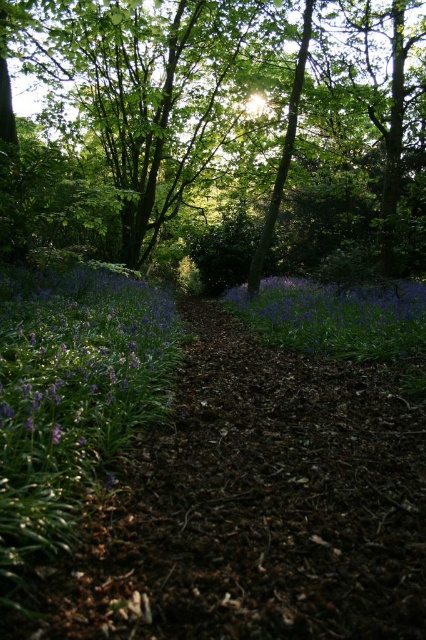
You are standing at the center of the woodland path and see the green leafy tree at center. If you walk straight ahead, will you eventually reach the tree?

The green leafy tree at center is located at point (219,125), which is in front of your current position at the center of the path. Therefore, walking straight ahead will lead you directly to the tree.

You are a gardener who wants to plant a new flower between the green leafy tree at center and the purple matte flower at center. The new flower requires a minimum of 4 meters of space between it and any existing plants. Can you plant it in this location?

The distance between the green leafy tree at center and the purple matte flower at center is 5.21 meters. Since the new flower requires at least 4 meters of space between it and existing plants, planting it between them would require the total distance to be at least 8 meters. However, the current distance is only 5.21 meters, so there isn not enough space to plant the new flower here.

You are a gardener who wants to plant flowers in a pot. You have two options from the scene, the purple matte flowers at lower left and the purple matte flower at center. Which one has a thicker stem?

The purple matte flower at center has a thicker stem than the purple matte flowers at lower left.